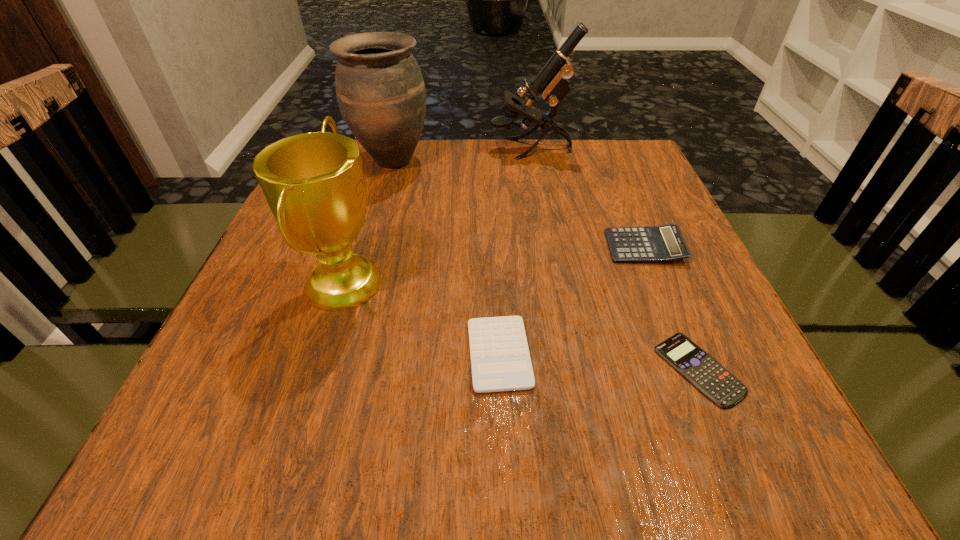
Find the location of a particular element. blank space that satisfies the following two spatial constraints: 1. on the back side of the shortest calculator; 2. on the shiny surface of the award is located at coordinates (661, 281).

At what (x,y) coordinates should I click in order to perform the action: click on free space that satisfies the following two spatial constraints: 1. on the back side of the third shortest object; 2. on the left side of the second tallest calculator. Please return your answer as a coordinate pair (x, y). Looking at the image, I should click on (495, 247).

Locate an element on the screen. vacant space that satisfies the following two spatial constraints: 1. on the shiny surface of the shortest object; 2. on the right side of the award is located at coordinates (317, 369).

I want to click on vacant space that satisfies the following two spatial constraints: 1. on the back side of the shortest calculator; 2. on the shiny surface of the award, so (661, 281).